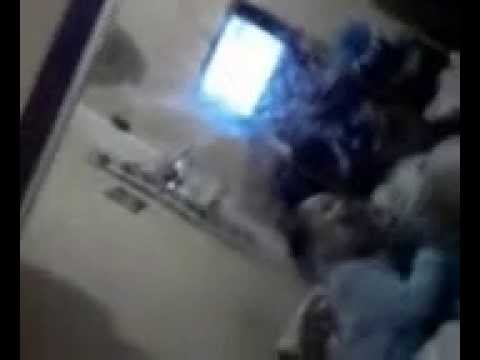
Find the location of `mirror frame`. mirror frame is located at coordinates (47, 101), (426, 22).